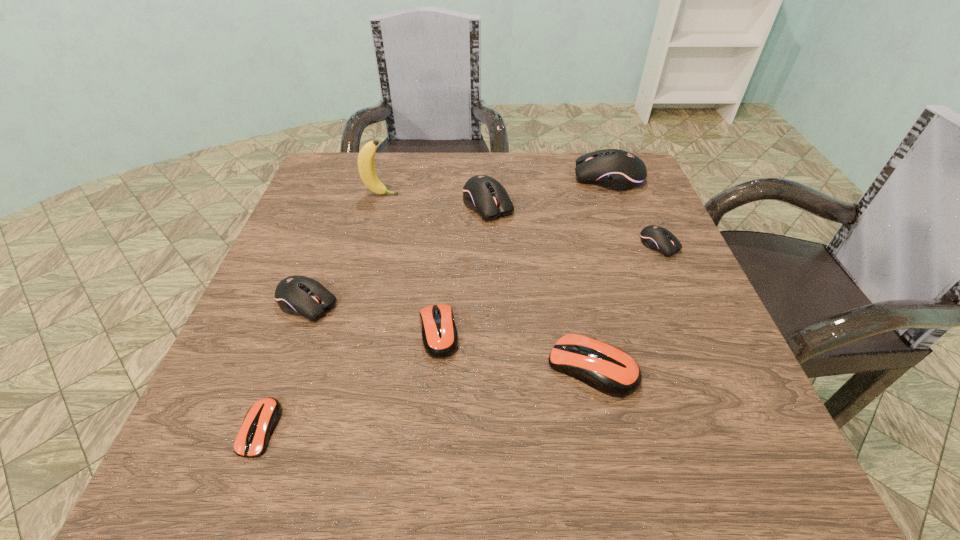
This screenshot has width=960, height=540. Identify the location of vacant space that satisfies the following two spatial constraints: 1. on the front side of the fifth nearest computer mouse; 2. on the left side of the tallest computer mouse. (634, 245).

The height and width of the screenshot is (540, 960). I want to click on free space that satisfies the following two spatial constraints: 1. from the stem of the banana; 2. on the left side of the biggest orange computer mouse, so click(334, 367).

The image size is (960, 540). I want to click on free location that satisfies the following two spatial constraints: 1. on the back side of the seventh shortest object; 2. on the right side of the second biggest orange computer mouse, so click(x=451, y=178).

Where is `vacant space that satisfies the following two spatial constraints: 1. from the stem of the tallest object; 2. on the back side of the second biggest orange computer mouse`? The width and height of the screenshot is (960, 540). vacant space that satisfies the following two spatial constraints: 1. from the stem of the tallest object; 2. on the back side of the second biggest orange computer mouse is located at coordinates (343, 333).

Find the location of a particular element. free region that satisfies the following two spatial constraints: 1. on the front side of the rightmost orange computer mouse; 2. on the left side of the second orange computer mouse from left to right is located at coordinates (436, 367).